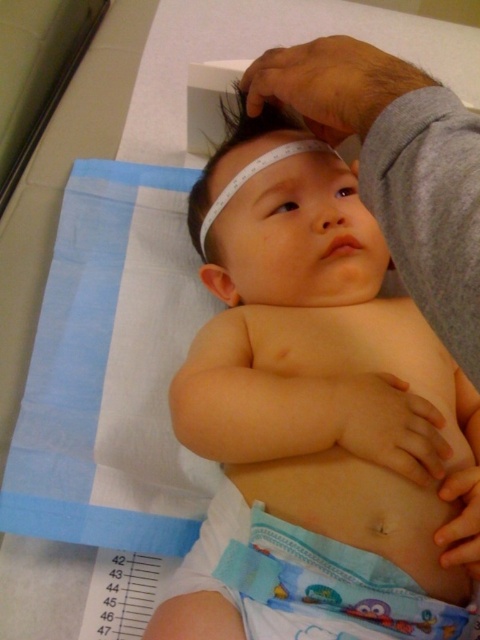
Question: Which of the following is the closest to the observer?

Choices:
 (A) blue printed diaper at center
 (B) white smooth baby at center

Answer: (A)

Question: Which of the following is the closest to the observer?

Choices:
 (A) (202, 220)
 (B) (424, 611)

Answer: (B)

Question: Does white smooth baby at center have a smaller size compared to blue printed diaper at center?

Choices:
 (A) no
 (B) yes

Answer: (A)

Question: Can you confirm if white smooth baby at center is positioned to the right of blue printed diaper at center?

Choices:
 (A) yes
 (B) no

Answer: (B)

Question: Which point appears farthest from the camera in this image?

Choices:
 (A) [210, 531]
 (B) [356, 552]

Answer: (A)

Question: Can you confirm if white smooth baby at center is wider than blue printed diaper at center?

Choices:
 (A) yes
 (B) no

Answer: (A)